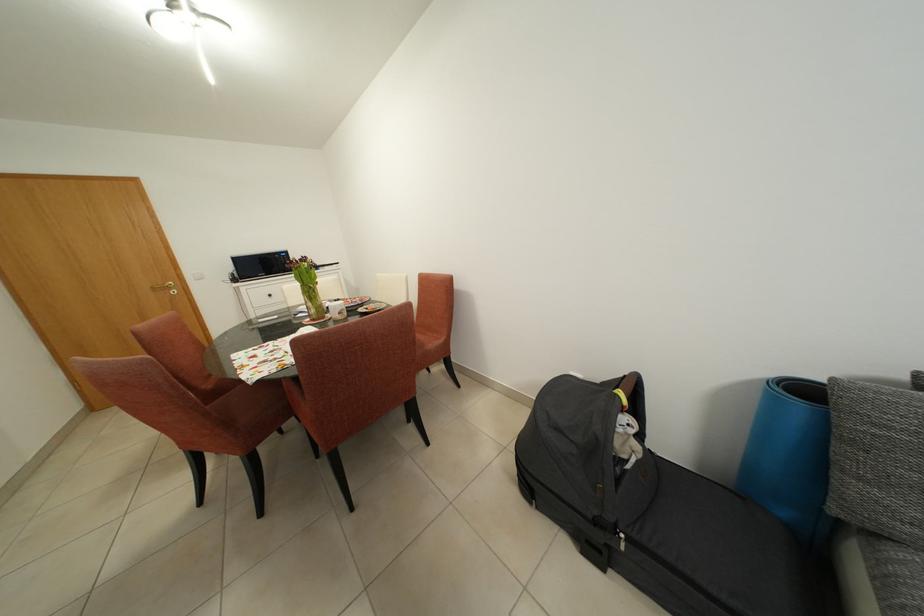
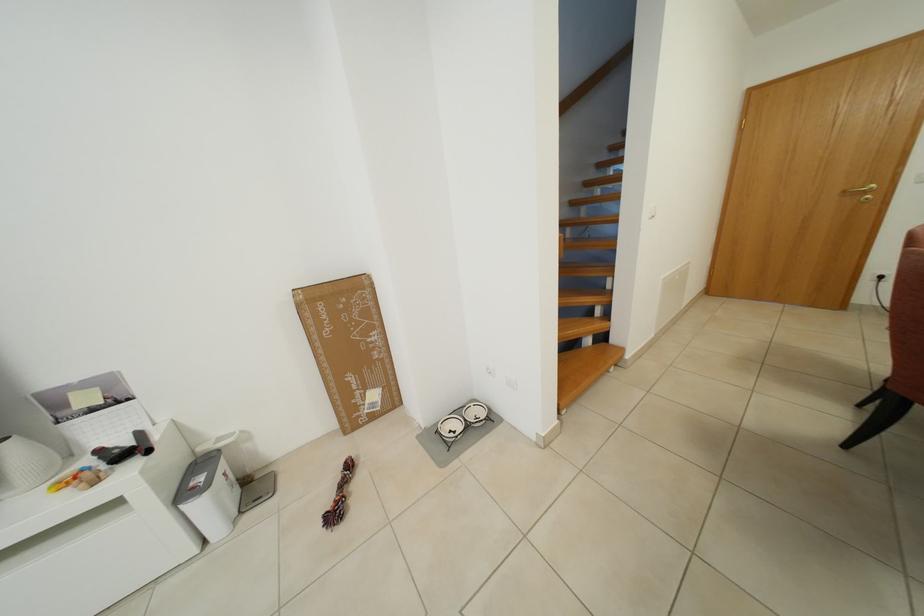
First-person continuous shooting, in which direction is the camera rotating?

The camera rotated toward left-down.